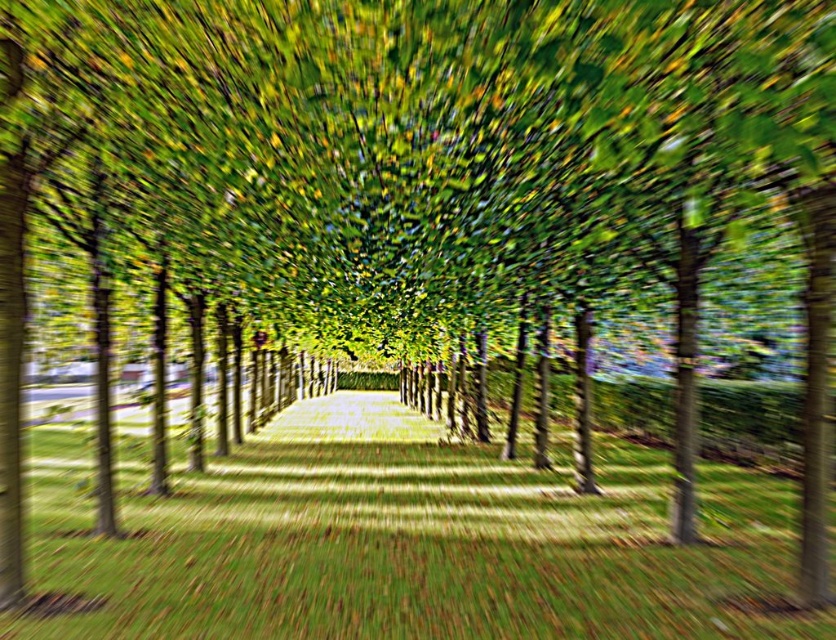
You are standing at the beginning of the pathway and want to reach the end. You notice two points marked on the path ahead of you. The first point is at coordinates point (x=36, y=544) and the second is at point (x=380, y=419). Which point should you aim for first if you want to reach the end of the path as quickly as possible?

You should aim for point (x=36, y=544) first because it is closer to the camera, meaning it is nearer to your current position. Since you are starting at the beginning of the pathway, moving towards the closer point first will allow you to progress along the path more efficiently toward the end.

You are standing at the point marked as point (406, 540) in the image. What type of ground surface are you currently standing on?

The point (406, 540) is on green grass at center, so you are standing on green grass.

You are standing at the entrance of the pathway and want to take a photo of the green grass at center and the green leafy canopy at center. Which object should you focus on if you want the one that appears larger in your photo?

The green grass at center appears larger in the photo than the green leafy canopy at center because it is closer to the camera, making it bigger in the frame.